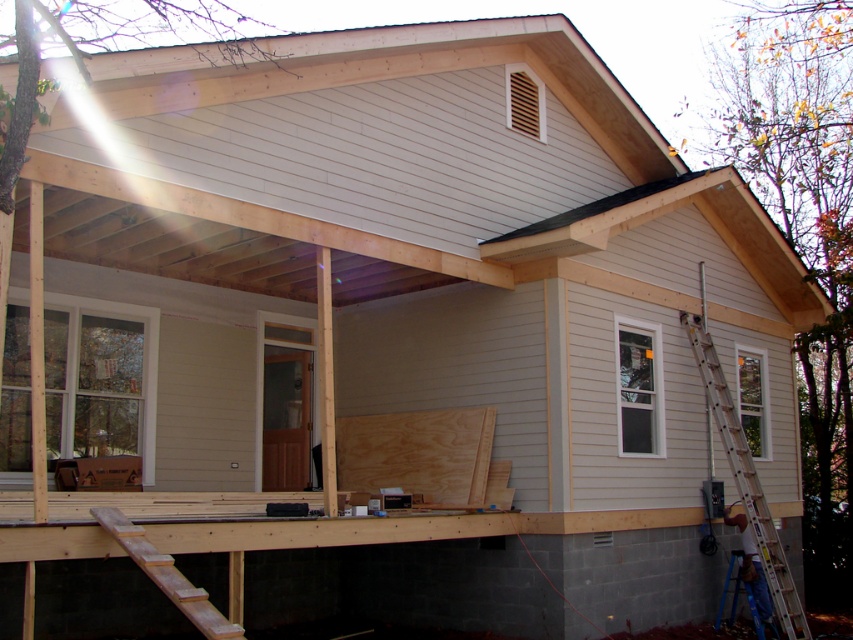
Question: Is blue metallic ladder at right further to the viewer compared to wooden ladder at lower left?

Choices:
 (A) no
 (B) yes

Answer: (B)

Question: Which point is farther to the camera?

Choices:
 (A) (718, 433)
 (B) (161, 563)

Answer: (A)

Question: Can you confirm if blue metallic ladder at right is positioned to the right of wooden ladder at lower left?

Choices:
 (A) no
 (B) yes

Answer: (B)

Question: Among these objects, which one is nearest to the camera?

Choices:
 (A) wooden ladder at lower left
 (B) blue metallic ladder at right

Answer: (A)

Question: From the image, what is the correct spatial relationship of blue metallic ladder at right in relation to wooden ladder at lower left?

Choices:
 (A) below
 (B) above

Answer: (B)